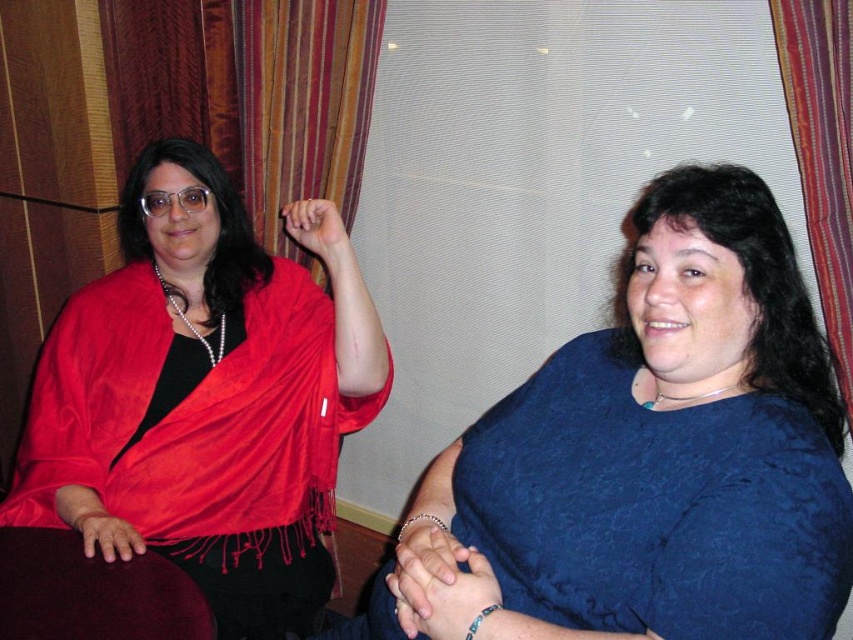
You are a fashion designer observing two people in the image. You need to decide which item, the satin red scarf at left or the blue satin blouse at center, requires more vertical space in your design layout. Based on their positions in the image, which one should you allocate more vertical space for?

The satin red scarf at left is taller than the blue satin blouse at center, so you should allocate more vertical space for the satin red scarf at left in your design layout.

You are an interior designer planning to hang a new painting above the blue satin blouse at center. According to the scene, where should the painting be placed in relation to the striped fabric curtain at right?

The blue satin blouse at center is positioned under the striped fabric curtain at right, so the painting should be placed above the striped fabric curtain at right to be correctly positioned above the blouse.

Based on the photo, you are an interior designer planning to place a small table between the two points in the image. Given that the table requires 0.3 units of space between the points to fit, can you determine if there is enough space between point (189, 568) and point (693, 348)?

The distance between point (189, 568) and point (693, 348) must be calculated to determine if there is enough space. However, the provided information only states their relative positions, not the actual distance. Therefore, it is impossible to confirm if the table will fit based on the given details.